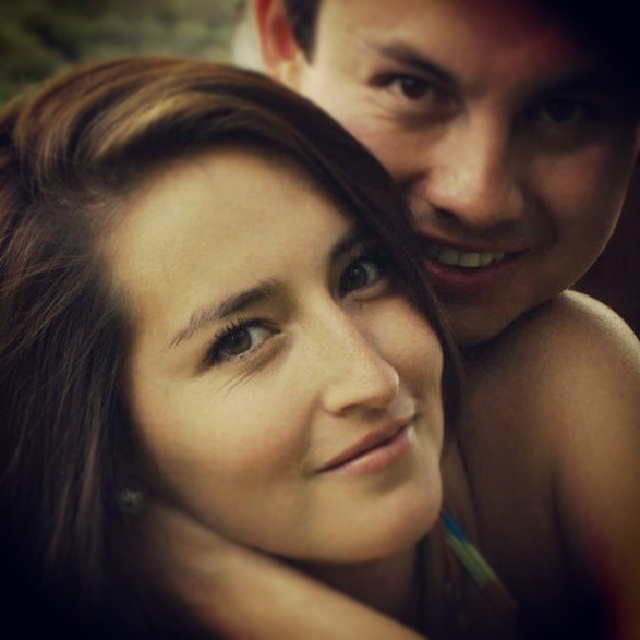
You are a photographer analyzing the image. You notice two skin textures in the scene. The first is the matte skin at center, and the second is the smooth skin face at upper right. Based on their sizes in the image, which one do you think is closer to the camera?

The matte skin at center has a smaller size compared to the smooth skin face at upper right, so the smooth skin face at upper right is closer to the camera because objects closer to the camera appear larger.

You are a photographer adjusting your camera to focus on the subject. There is a point at coordinates point (x=214, y=356) which is marked as matte skin at center. Where should you focus your camera to capture the matte skin at center?

The point at coordinates point (x=214, y=356) marks the location of the matte skin at center, so you should focus your camera on that point to capture the matte skin at center.